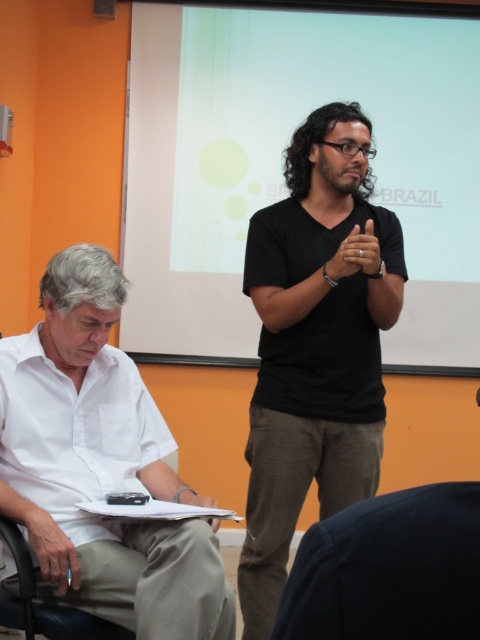
Question: Is black matte shirt at center thinner than white cotton shirt at left?

Choices:
 (A) yes
 (B) no

Answer: (A)

Question: Which object appears farthest from the camera in this image?

Choices:
 (A) white cotton shirt at left
 (B) black matte shirt at center

Answer: (B)

Question: Is black matte shirt at center to the right of white cotton shirt at left from the viewer's perspective?

Choices:
 (A) no
 (B) yes

Answer: (B)

Question: Which of the following is the farthest from the observer?

Choices:
 (A) white cotton shirt at left
 (B) black matte shirt at center

Answer: (B)

Question: Can you confirm if black matte shirt at center is positioned to the right of white cotton shirt at left?

Choices:
 (A) yes
 (B) no

Answer: (A)